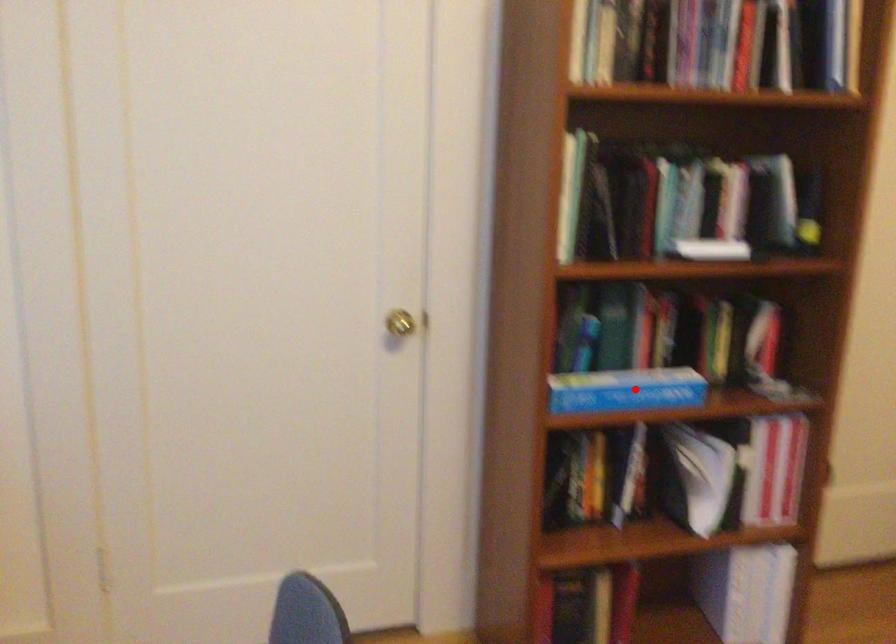
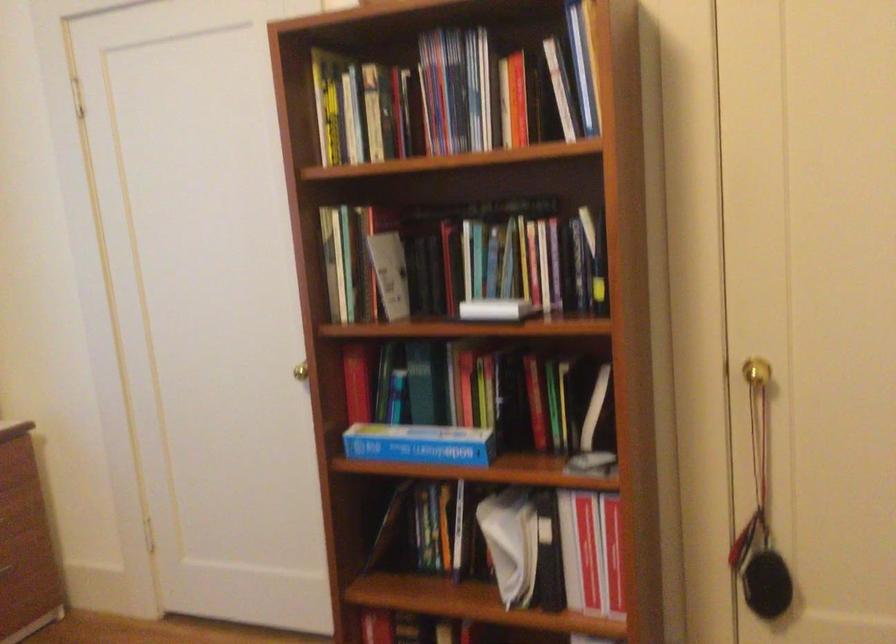
Locate, in the second image, the point that corresponds to the highlighted location in the first image.

(419, 444)